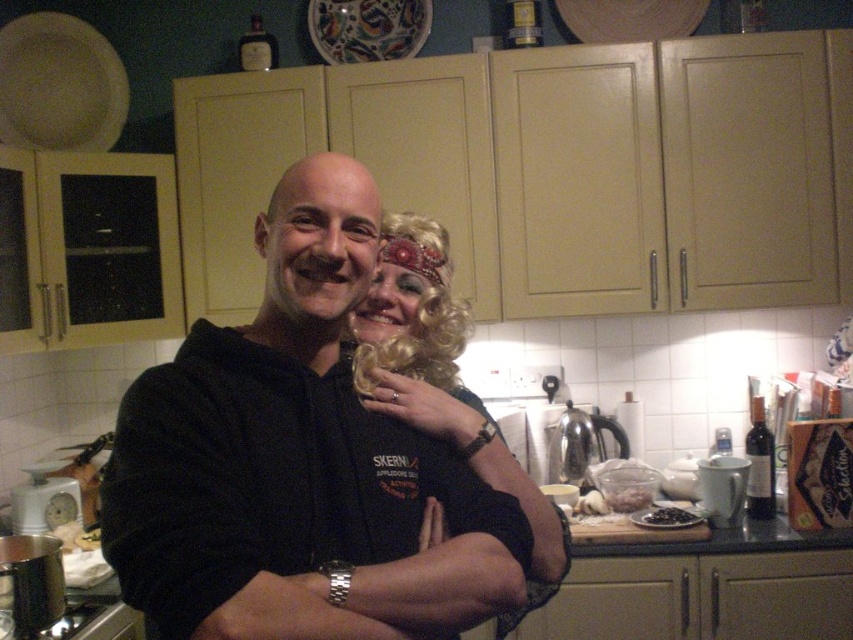
You are designing a new line of kitchen aprons and need to ensure they fit over both the black matte hoodie at center and the blonde curly wig at center. If the smallest apron size is designed to fit over the smaller of the two items, which item will determine the minimum size requirement?

The smallest apron size must be designed to fit over the blonde curly wig at center since it is smaller than the black matte hoodie at center.

You are a photographer setting up a shoot in the kitchen. You need to position a light source to the right of the blonde curly wig at center and to the left of the black fabric arm at center. Is this possible based on their current positions?

The blonde curly wig at center is to the left of the black fabric arm at center, so placing the light source to the right of the blonde curly wig at center and to the left of the black fabric arm at center is possible as there is space between them.

You are a photographer adjusting your camera settings in the kitchen. You notice the black matte hoodie at center and the black fabric arm at center. Which object is positioned higher in the image?

The black matte hoodie at center is positioned higher than the black fabric arm at center in the image.